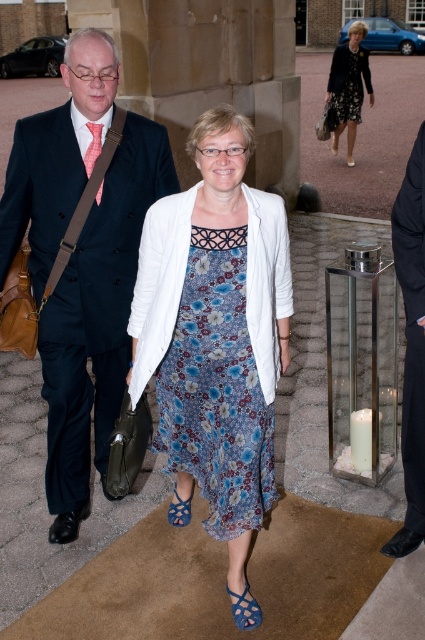
Question: Is the position of black fabric business suit at right less distant than that of blue fabric sandal at lower center?

Choices:
 (A) no
 (B) yes

Answer: (A)

Question: Is floral fabric dress at center below blue woven sandal at center?

Choices:
 (A) yes
 (B) no

Answer: (B)

Question: Which object appears closest to the camera in this image?

Choices:
 (A) black textured dress at upper center
 (B) blue fabric sandal at lower center

Answer: (B)

Question: Which of the following is the closest to the observer?

Choices:
 (A) blue fabric sandal at lower center
 (B) black fabric business suit at right
 (C) matte black suit at left
 (D) floral-patterned fabric dress at center

Answer: (D)

Question: Which point is closer to the camera taking this photo?

Choices:
 (A) (59, 189)
 (B) (102, 179)

Answer: (A)

Question: Does matte black suit at left appear over black fabric business suit at right?

Choices:
 (A) yes
 (B) no

Answer: (A)